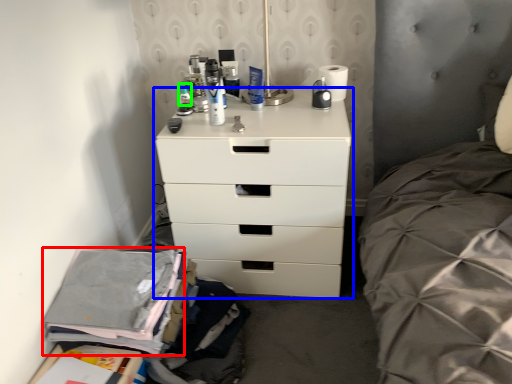
Question: Which object is the farthest from clothing (highlighted by a red box)? Choose among these: chest of drawers (highlighted by a blue box) or toiletry (highlighted by a green box).

Choices:
 (A) chest of drawers
 (B) toiletry

Answer: (B)